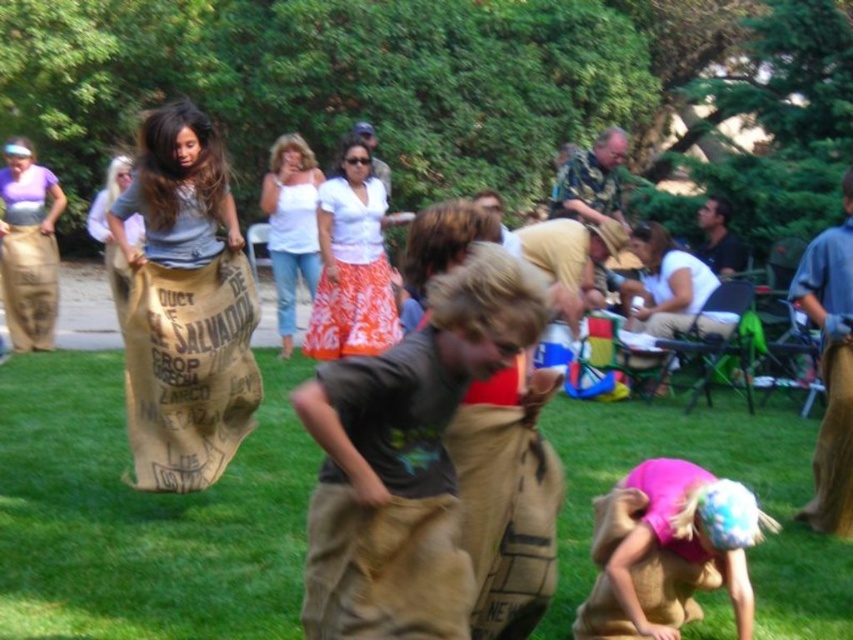
You are standing at the starting line of the sack race and see the green grass at lower center and the pink fabric at lower right. Which object is closer to your right side?

The pink fabric at lower right is closer to your right side because it is positioned to the right of the green grass at lower center.

You are standing at the starting line of the sack race and see the green grass at lower center and the burlap sack at center. Which object is closer to your right side?

The green grass at lower center is to the right of the burlap sack at center, so the green grass at lower center is closer to your right side.